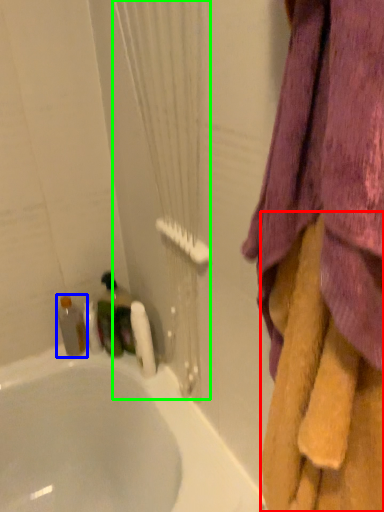
Question: Estimate the real-world distances between objects in this image. Which object is closer to towel (highlighted by a red box), bottle (highlighted by a blue box) or shower curtain (highlighted by a green box)?

Choices:
 (A) bottle
 (B) shower curtain

Answer: (B)